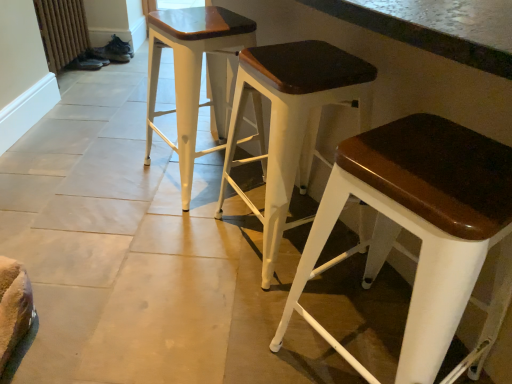
Question: Is matte white stool at center, which is the second stool from left to right, surrounded by white wood stool at center, the 3th stool in the right-to-left sequence?

Choices:
 (A) no
 (B) yes

Answer: (A)

Question: Can you confirm if white wood stool at center, the 3th stool in the right-to-left sequence, is taller than matte white stool at center, acting as the 2th stool starting from the right?

Choices:
 (A) no
 (B) yes

Answer: (A)

Question: Is the position of white wood stool at center, the first stool when ordered from left to right, less distant than that of matte white stool at center, which is the second stool from left to right?

Choices:
 (A) yes
 (B) no

Answer: (B)

Question: From a real-world perspective, is white wood stool at center, the first stool when ordered from left to right, positioned under matte white stool at center, which is the second stool from left to right, based on gravity?

Choices:
 (A) no
 (B) yes

Answer: (B)

Question: Is white wood stool at center, the 3th stool in the right-to-left sequence, wider than matte white stool at center, which is the second stool from left to right?

Choices:
 (A) no
 (B) yes

Answer: (B)

Question: Does white wood stool at center, the first stool when ordered from left to right, appear on the left side of matte white stool at center, acting as the 2th stool starting from the right?

Choices:
 (A) yes
 (B) no

Answer: (A)

Question: Can you confirm if white wood stool at center, the 3th stool in the right-to-left sequence, is shorter than white wood stool at center, the 3th stool in the left-to-right sequence?

Choices:
 (A) yes
 (B) no

Answer: (B)

Question: Does white wood stool at center, the first stool when ordered from left to right, have a smaller size compared to white wood stool at center, the 3th stool in the left-to-right sequence?

Choices:
 (A) yes
 (B) no

Answer: (B)

Question: From the image's perspective, is white wood stool at center, the first stool when ordered from left to right, under white wood stool at center, the first stool viewed from the right?

Choices:
 (A) no
 (B) yes

Answer: (A)

Question: Does white wood stool at center, the first stool when ordered from left to right, have a lesser width compared to white wood stool at center, the first stool viewed from the right?

Choices:
 (A) yes
 (B) no

Answer: (B)

Question: From a real-world perspective, is white wood stool at center, the 3th stool in the right-to-left sequence, under white wood stool at center, the 3th stool in the left-to-right sequence?

Choices:
 (A) yes
 (B) no

Answer: (B)

Question: Is white wood stool at center, the 3th stool in the right-to-left sequence, at the right side of white wood stool at center, the 3th stool in the left-to-right sequence?

Choices:
 (A) no
 (B) yes

Answer: (A)

Question: Can you confirm if matte white stool at center, acting as the 2th stool starting from the right, is thinner than white wood stool at center, the first stool viewed from the right?

Choices:
 (A) no
 (B) yes

Answer: (B)